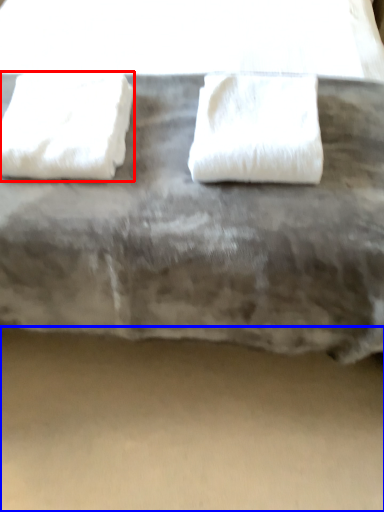
Question: Which point is further to the camera, towel (highlighted by a red box) or concrete (highlighted by a blue box)?

Choices:
 (A) towel
 (B) concrete

Answer: (B)